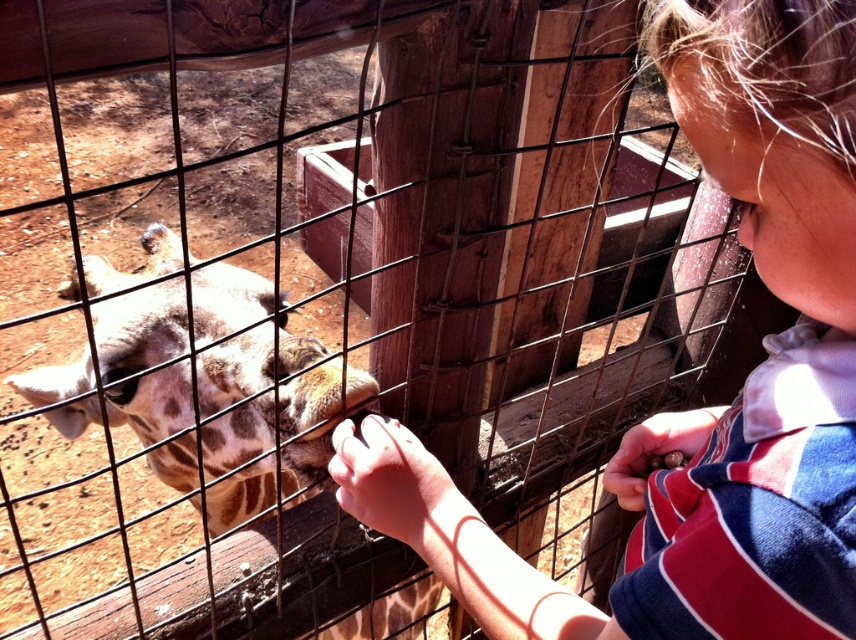
Who is higher up, spotted fur giraffe at left or smooth brown nut at center?

smooth brown nut at center is higher up.

Between point (123, 284) and point (681, 429), which one is positioned in front?

Point (681, 429)

Does point (325, 486) lie behind point (703, 426)?

Yes, it is behind point (703, 426).

Where is `spotted fur giraffe at left`? This screenshot has width=856, height=640. spotted fur giraffe at left is located at coordinates (203, 388).

Is sun-kissed skin at center bigger than smooth brown nut at center?

Yes.

The height and width of the screenshot is (640, 856). What do you see at coordinates (397, 486) in the screenshot?
I see `sun-kissed skin at center` at bounding box center [397, 486].

Describe the element at coordinates (397, 486) in the screenshot. I see `sun-kissed skin at center` at that location.

The width and height of the screenshot is (856, 640). I want to click on sun-kissed skin at center, so click(x=397, y=486).

Looking at this image, which is below, striped cotton shirt at center or matte skin nose at upper right?

Positioned lower is striped cotton shirt at center.

Can you confirm if striped cotton shirt at center is positioned to the right of matte skin nose at upper right?

No, striped cotton shirt at center is not to the right of matte skin nose at upper right.

In order to click on striped cotton shirt at center in this screenshot , I will do `click(758, 368)`.